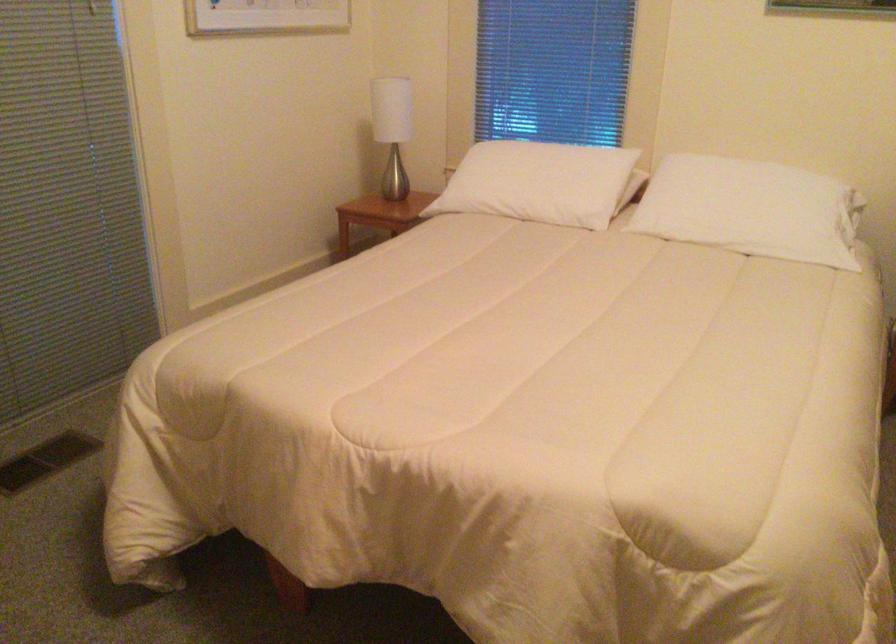
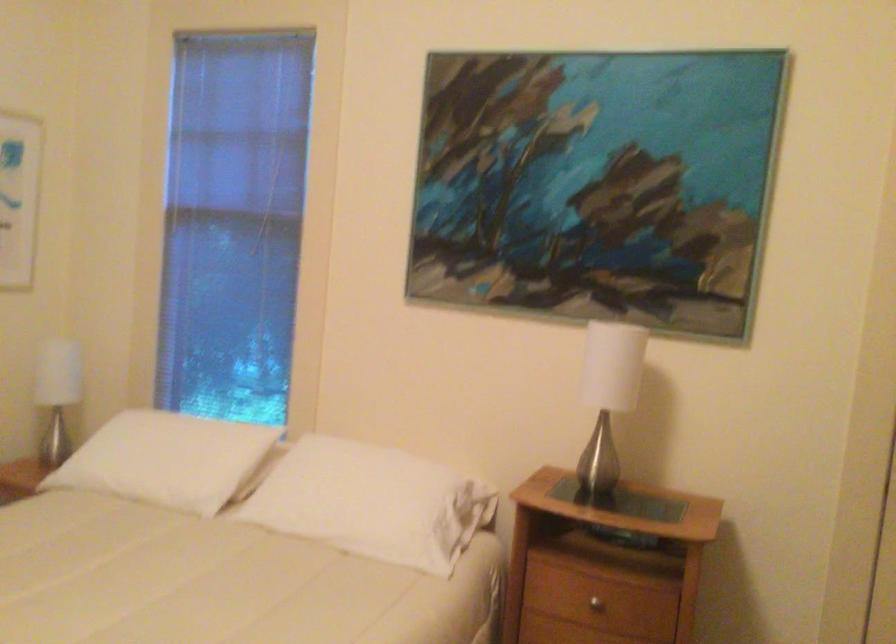
Find the pixel in the second image that matches the point at 549,178 in the first image.

(167, 459)